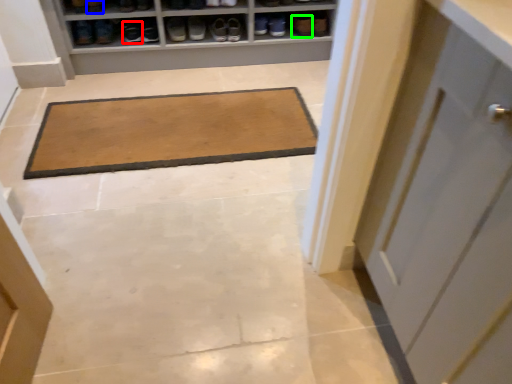
Question: Which object is the farthest from footwear (highlighted by a red box)? Choose among these: shoe (highlighted by a blue box) or shoe (highlighted by a green box).

Choices:
 (A) shoe
 (B) shoe

Answer: (B)